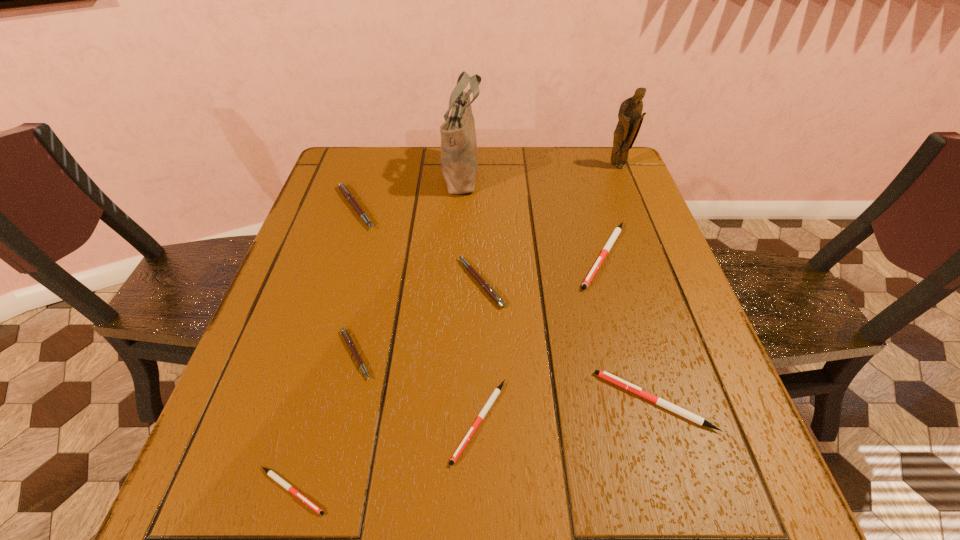
Locate which pen ranks third in proximity to the biggest pink pen. Please provide its 2D coordinates. Your answer should be formatted as a tuple, i.e. [(x, y)], where the tuple contains the x and y coordinates of a point satisfying the conditions above.

[(496, 392)]

Find the location of a particular element. the third closest pen to the third white pen from right to left is located at coordinates (490, 291).

Locate which pink pen is the third closest to the shoulder bag. Please provide its 2D coordinates. Your answer should be formatted as a tuple, i.e. [(x, y)], where the tuple contains the x and y coordinates of a point satisfying the conditions above.

[(344, 332)]

What are the coordinates of `pink pen that is the closest to the farthest pink pen` in the screenshot? It's located at (490, 291).

What are the coordinates of `the fourth closest white pen to the tallest object` in the screenshot? It's located at (287, 486).

The image size is (960, 540). I want to click on white pen that can be found as the third closest to the farthest white pen, so click(287, 486).

What are the coordinates of `free space that satisfies the following two spatial constraints: 1. on the front-facing side of the figurine; 2. at the nib of the farthest pink pen` in the screenshot? It's located at (634, 208).